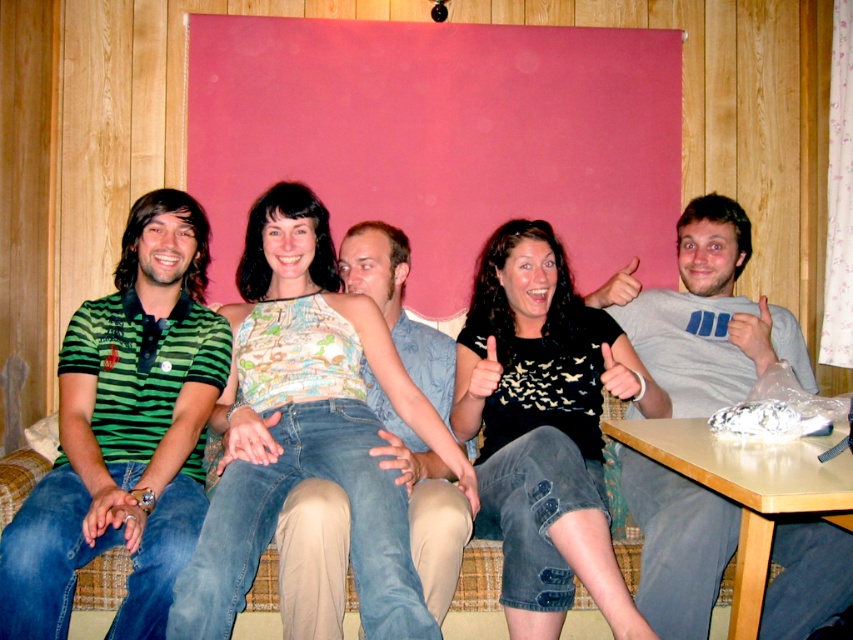
You are standing in front of the group of five individuals seated on the woven wicker couch. There are two points marked on the couch. One is at coordinate point (276, 492) and the other is at point (692, 275). Which point is closer to you?

The point at coordinate (276, 492) is closer to you than the point at (692, 275).

You are organizing a charity event and need to determine clothing sizes for donations. You see the green striped polo shirt at left and the gray cotton shirt at center in the image. Which shirt should you categorize as the smaller size?

The green striped polo shirt at left has a smaller size compared to the gray cotton shirt at center, so you should categorize the green striped polo shirt at left as the smaller size.

Looking at this image, you are a photographer setting up a shoot in the scene described. You need to ensure that the patterned fabric top at center and the green striped polo shirt at left are both visible in the frame. Given their height differences, which clothing item might require you to adjust your camera angle to avoid being blocked?

The patterned fabric top at center is shorter than the green striped polo shirt at left, so you might need to lower the camera angle to ensure the shorter patterned fabric top at center isn not blocked by the taller green striped polo shirt at left.